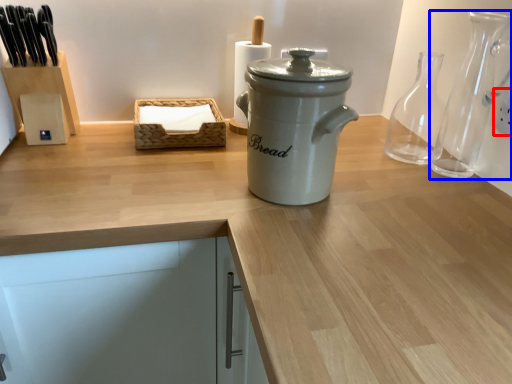
Question: Which of the following is the closest to the observer, electric outlet (highlighted by a red box) or glass vase (highlighted by a blue box)?

Choices:
 (A) electric outlet
 (B) glass vase

Answer: (B)